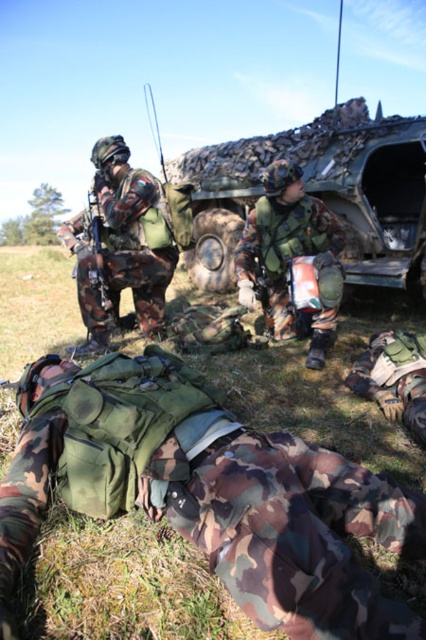
Is camouflage fabric helmet at upper left further to the viewer compared to camouflage fabric helmet at center?

Yes, camouflage fabric helmet at upper left is further from the viewer.

In the scene shown: Does camouflage fabric helmet at upper left lie in front of camouflage fabric helmet at center?

No, camouflage fabric helmet at upper left is further to the viewer.

Image resolution: width=426 pixels, height=640 pixels. In order to click on camouflage fabric helmet at upper left in this screenshot , I will do `click(121, 246)`.

Identify the location of camouflage fabric helmet at upper left. (121, 246).

Is the position of camouflage fabric vest at lower center less distant than that of camouflage fabric vehicle at upper center?

Yes.

Is camouflage fabric vest at lower center smaller than camouflage fabric vehicle at upper center?

Yes.

I want to click on camouflage fabric vest at lower center, so click(x=212, y=493).

Where is `camouflage fabric vest at lower center`? camouflage fabric vest at lower center is located at coordinates (212, 493).

Looking at this image, is camouflage fabric vehicle at upper center wider than camouflage fabric helmet at upper left?

Correct, the width of camouflage fabric vehicle at upper center exceeds that of camouflage fabric helmet at upper left.

Does point (368, 182) come closer to viewer compared to point (83, 218)?

No, it is behind (83, 218).

At what (x,y) coordinates should I click in order to perform the action: click on camouflage fabric vehicle at upper center. Please return your answer as a coordinate pair (x, y). Image resolution: width=426 pixels, height=640 pixels. Looking at the image, I should click on [x=319, y=193].